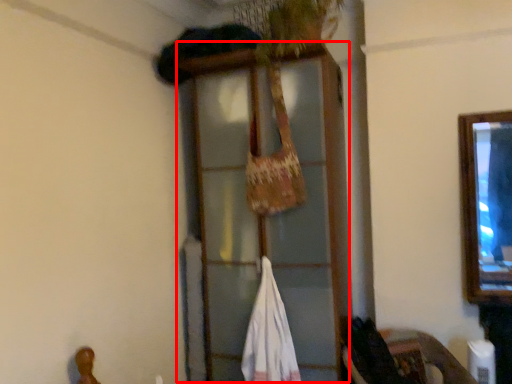
Question: Where is window frame (annotated by the red box) located in relation to wide in the image?

Choices:
 (A) left
 (B) right

Answer: (B)